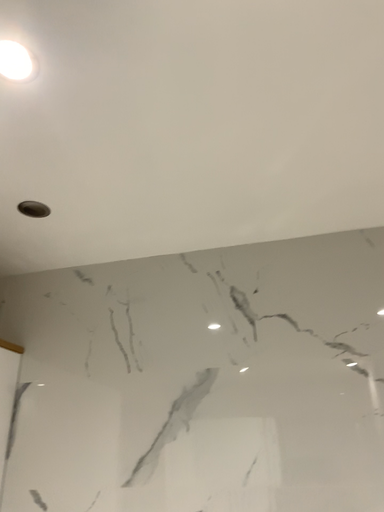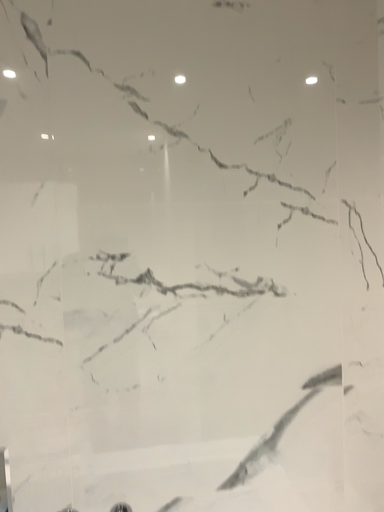
Question: Which way did the camera rotate in the video?

Choices:
 (A) rotated downward
 (B) rotated upward

Answer: (A)